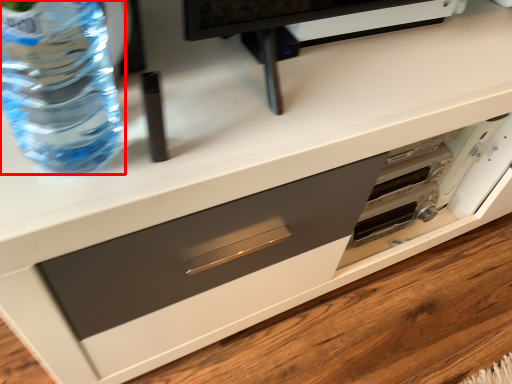
Question: From the image's perspective, what is the correct spatial positioning of bottle (annotated by the red box) in reference to drawer?

Choices:
 (A) below
 (B) above

Answer: (B)